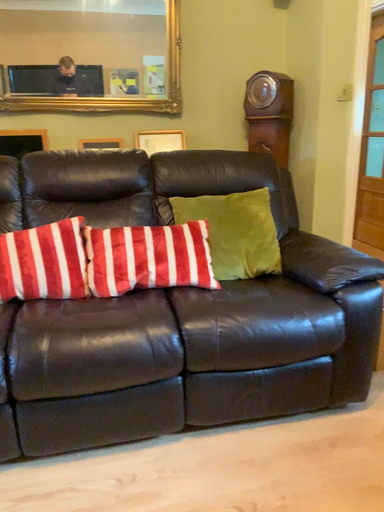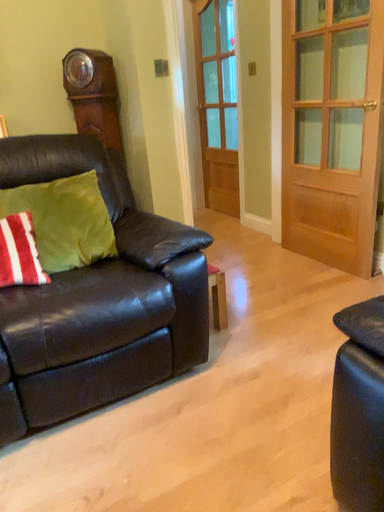
Question: How did the camera likely rotate when shooting the video?

Choices:
 (A) rotated left
 (B) rotated right

Answer: (B)